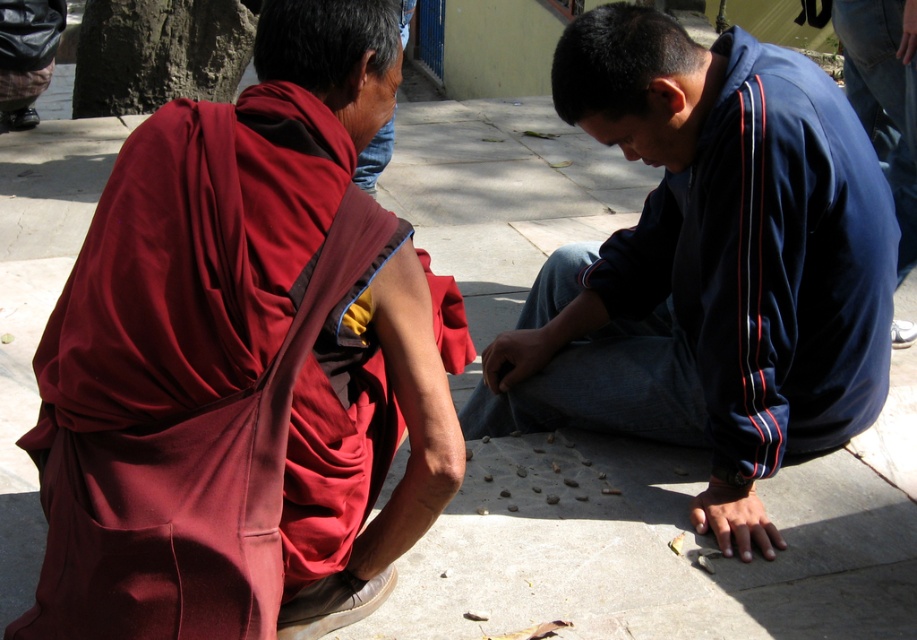
You are a tailor who needs to determine which garment requires more fabric to make between the maroon silk robe at left and the dark blue velour jacket at center. Based on their sizes, which one would need more fabric?

The dark blue velour jacket at center requires more fabric because it is larger in size than the maroon silk robe at left.

You are a photographer wanting to capture both the maroon silk robe at left and the dark blue velour jacket at center in a single frame. Based on their positions, which object should you position closer to the left side of your camera frame?

The maroon silk robe at left should be positioned closer to the left side of your camera frame since it is located to the left of the dark blue velour jacket at center.

You are a photographer trying to capture a closeup of the maroon silk robe at left. You are currently standing at point (x=245, y=362). Which direction should you move to get a better shot?

The maroon silk robe at left is located at point (x=245, y=362). Since you are already at that point, you should move closer to that location to get a better closeup shot.